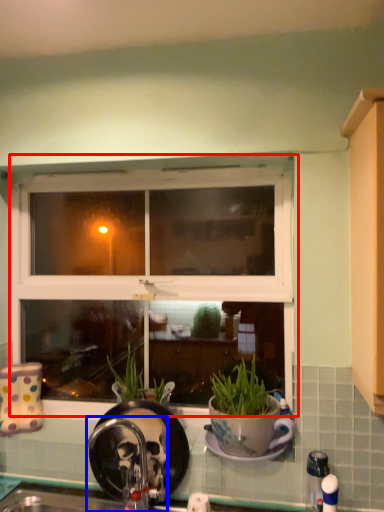
Question: Which of the following is the closest to the observer, window (highlighted by a red box) or faucet (highlighted by a blue box)?

Choices:
 (A) window
 (B) faucet

Answer: (B)